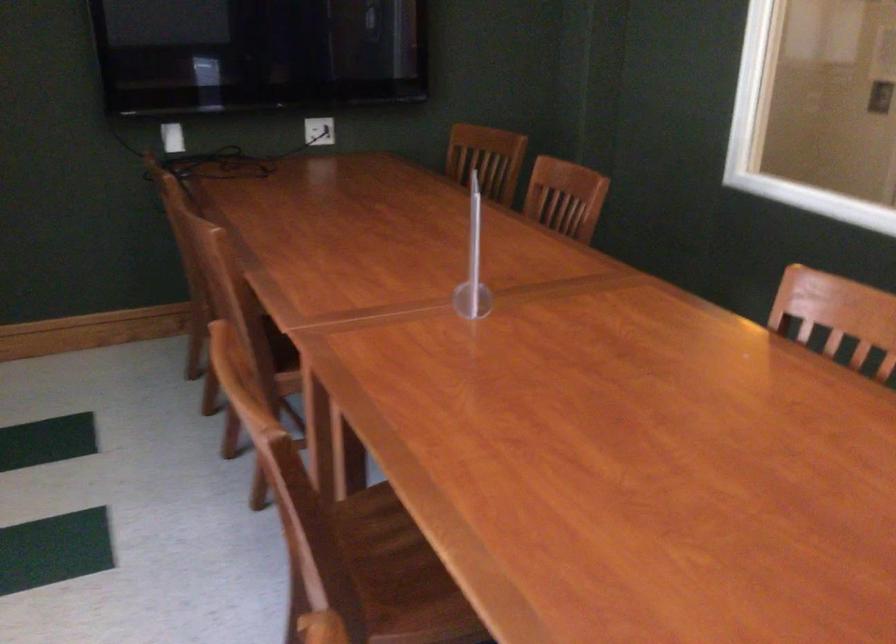
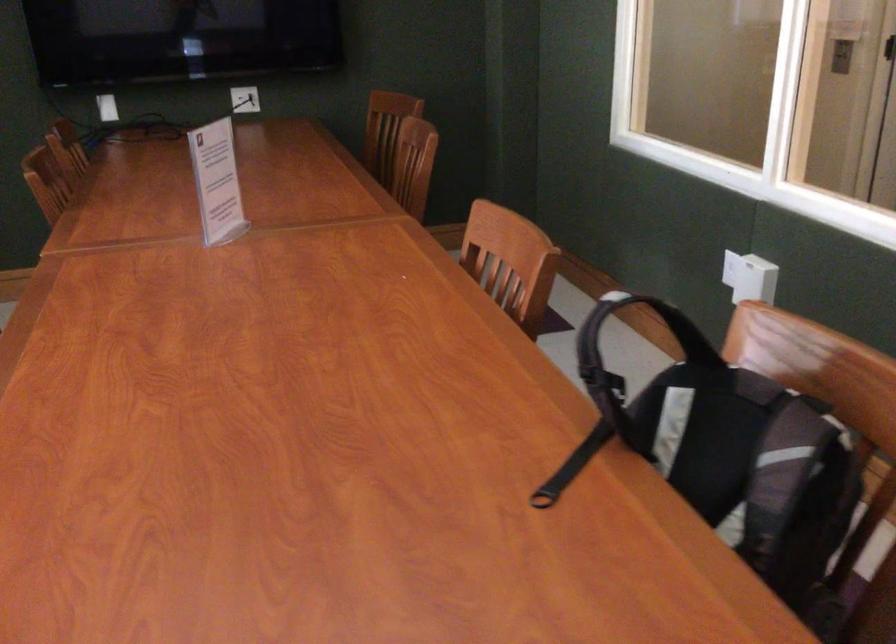
Question: The camera is either moving clockwise (left) or counter-clockwise (right) around the object. The first image is from the beginning of the video and the second image is from the end. Is the camera moving left or right when shooting the video?

Choices:
 (A) Left
 (B) Right

Answer: (B)